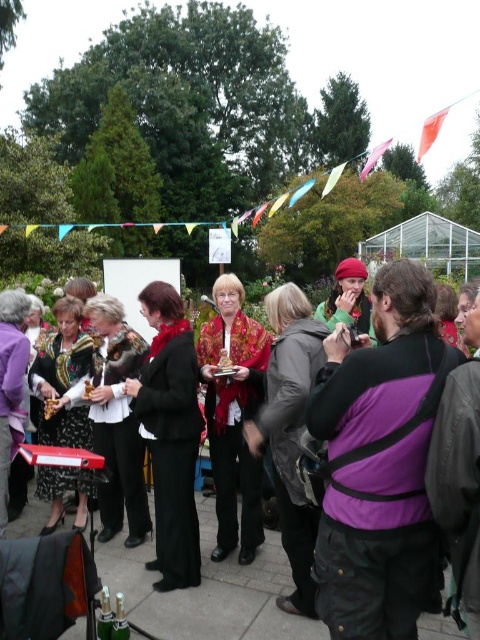
You are standing at the origin point of the coordinate system in this image. You want to move towards the black matte jacket at center. What direction should you move in to reach it?

Since the black matte jacket at center is located at coordinate point 0.680 on the x axis and 0.356 on the y axis, you should move towards the right and slightly forward to reach it.